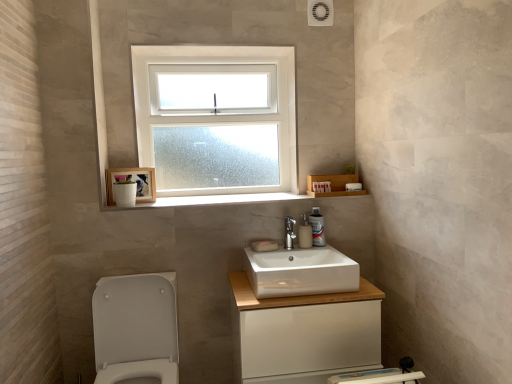
Question: Considering the relative positions of white matte soap at center, acting as the 2th soap starting from the back, and white matte soap at center, which is the 2th soap from front to back, in the image provided, is white matte soap at center, acting as the 2th soap starting from the back, to the right of white matte soap at center, which is the 2th soap from front to back, from the viewer's perspective?

Choices:
 (A) no
 (B) yes

Answer: (B)

Question: Is white matte soap at center, acting as the 2th soap starting from the back, taller than white matte soap at center, which is the 2th soap from front to back?

Choices:
 (A) yes
 (B) no

Answer: (A)

Question: Is white matte soap at center, the 1th soap from the front, positioned behind white matte soap at center, the first soap in the back-to-front sequence?

Choices:
 (A) no
 (B) yes

Answer: (A)

Question: Is white matte soap at center, the 1th soap from the front, completely or partially outside of white matte soap at center, the first soap in the back-to-front sequence?

Choices:
 (A) yes
 (B) no

Answer: (A)

Question: Does white matte soap at center, acting as the 2th soap starting from the back, come in front of white matte soap at center, which is the 2th soap from front to back?

Choices:
 (A) no
 (B) yes

Answer: (B)

Question: Considering the positions of white marble window sill at center and translucent plastic soap dispenser at center, marked as the second soap dispenser in a right-to-left arrangement, in the image, is white marble window sill at center bigger or smaller than translucent plastic soap dispenser at center, marked as the second soap dispenser in a right-to-left arrangement,?

Choices:
 (A) big
 (B) small

Answer: (A)

Question: Is white marble window sill at center in front of or behind translucent plastic soap dispenser at center, marked as the second soap dispenser in a right-to-left arrangement, in the image?

Choices:
 (A) front
 (B) behind

Answer: (A)

Question: Does point (272, 200) appear closer or farther from the camera than point (304, 226)?

Choices:
 (A) farther
 (B) closer

Answer: (A)

Question: Would you say white marble window sill at center is inside or outside translucent plastic soap dispenser at center, marked as the second soap dispenser in a right-to-left arrangement?

Choices:
 (A) inside
 (B) outside

Answer: (B)

Question: Based on their positions, is white matte soap at center, acting as the 2th soap starting from the back, located to the left or right of white glossy toilet at lower left?

Choices:
 (A) left
 (B) right

Answer: (B)

Question: In the image, is white matte soap at center, the 1th soap from the front, positioned in front of or behind white glossy toilet at lower left?

Choices:
 (A) front
 (B) behind

Answer: (B)

Question: Considering the positions of white matte soap at center, the 1th soap from the front, and white glossy toilet at lower left in the image, is white matte soap at center, the 1th soap from the front, bigger or smaller than white glossy toilet at lower left?

Choices:
 (A) big
 (B) small

Answer: (B)

Question: Is white matte soap at center, the 1th soap from the front, wider or thinner than white glossy toilet at lower left?

Choices:
 (A) thin
 (B) wide

Answer: (A)

Question: Is point (270, 241) closer or farther from the camera than point (289, 175)?

Choices:
 (A) farther
 (B) closer

Answer: (B)

Question: From a real-world perspective, is white matte soap at center, the 1th soap from the front, above or below clear glass window at upper center?

Choices:
 (A) below
 (B) above

Answer: (A)